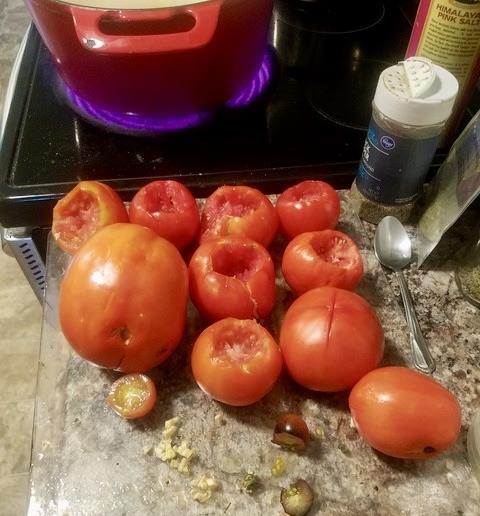
I want to click on counter, so click(119, 490).